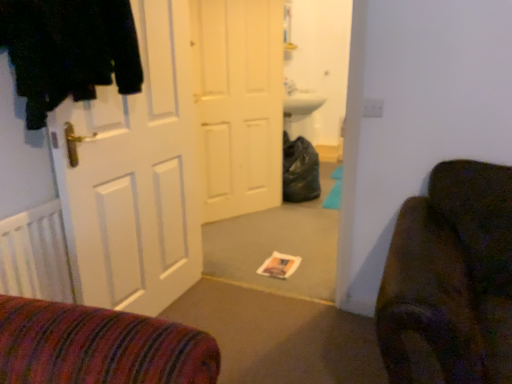
Find the location of a particular element. The height and width of the screenshot is (384, 512). vacant area to the right of white matte door at left, which ranks as the 2th door in back-to-front order is located at coordinates (237, 318).